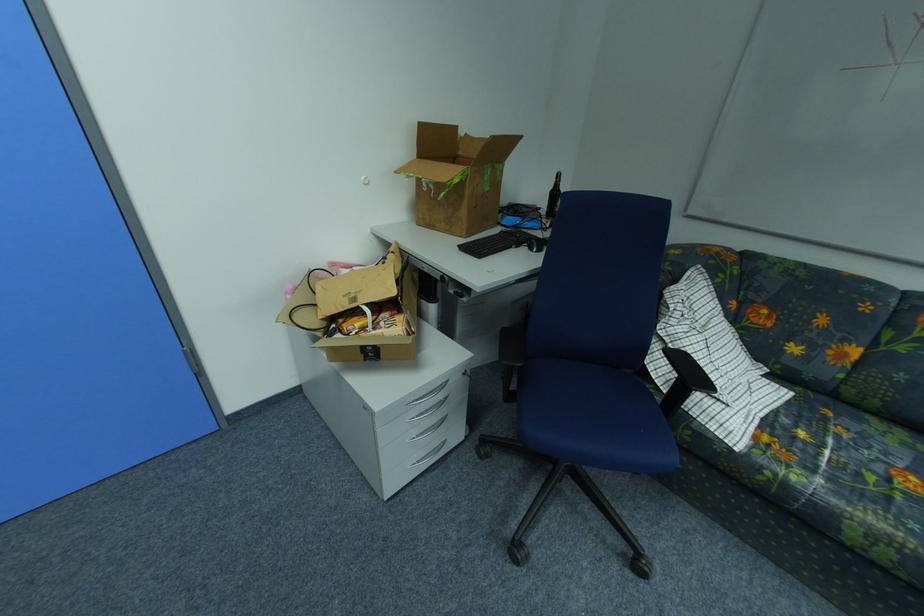
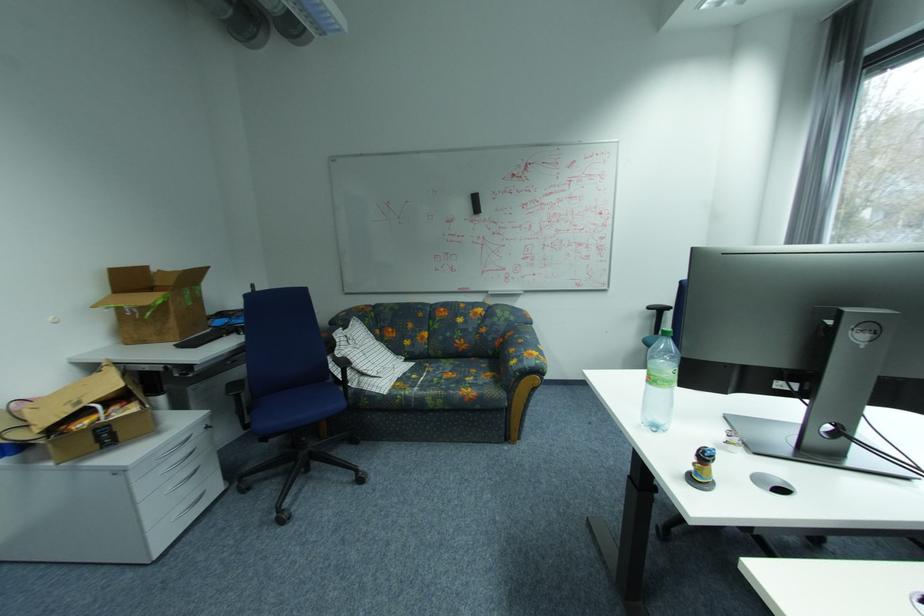
The point at (470,214) is marked in the first image. Where is the corresponding point in the second image?

(180, 323)